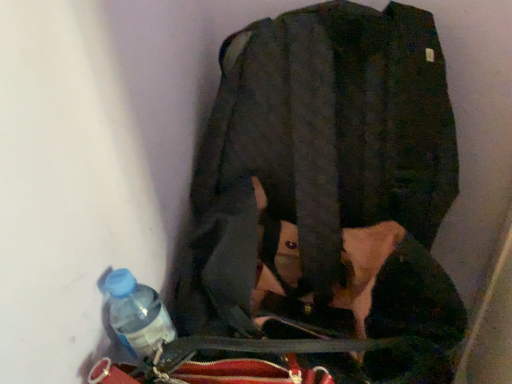
Question: Is matte black jacket at center outside translucent plastic bottle at lower left?

Choices:
 (A) yes
 (B) no

Answer: (A)

Question: Can you confirm if matte black jacket at center is positioned to the right of translucent plastic bottle at lower left?

Choices:
 (A) yes
 (B) no

Answer: (A)

Question: Is matte black jacket at center facing away from translucent plastic bottle at lower left?

Choices:
 (A) yes
 (B) no

Answer: (B)

Question: Is matte black jacket at center wider than translucent plastic bottle at lower left?

Choices:
 (A) no
 (B) yes

Answer: (B)

Question: From the image's perspective, is matte black jacket at center on top of translucent plastic bottle at lower left?

Choices:
 (A) no
 (B) yes

Answer: (B)

Question: Would you say matte black jacket at center contains translucent plastic bottle at lower left?

Choices:
 (A) no
 (B) yes

Answer: (A)

Question: Can you see translucent plastic bottle at lower left touching matte black jacket at center?

Choices:
 (A) yes
 (B) no

Answer: (B)

Question: Does translucent plastic bottle at lower left come in front of matte black jacket at center?

Choices:
 (A) no
 (B) yes

Answer: (A)

Question: Is translucent plastic bottle at lower left at the right side of matte black jacket at center?

Choices:
 (A) no
 (B) yes

Answer: (A)

Question: From the image's perspective, is translucent plastic bottle at lower left on top of matte black jacket at center?

Choices:
 (A) no
 (B) yes

Answer: (A)

Question: Could you tell me if translucent plastic bottle at lower left is turned towards matte black jacket at center?

Choices:
 (A) no
 (B) yes

Answer: (A)

Question: Would you say matte black jacket at center is part of translucent plastic bottle at lower left's contents?

Choices:
 (A) no
 (B) yes

Answer: (A)

Question: From the image's perspective, relative to matte black jacket at center, is translucent plastic bottle at lower left above or below?

Choices:
 (A) above
 (B) below

Answer: (B)